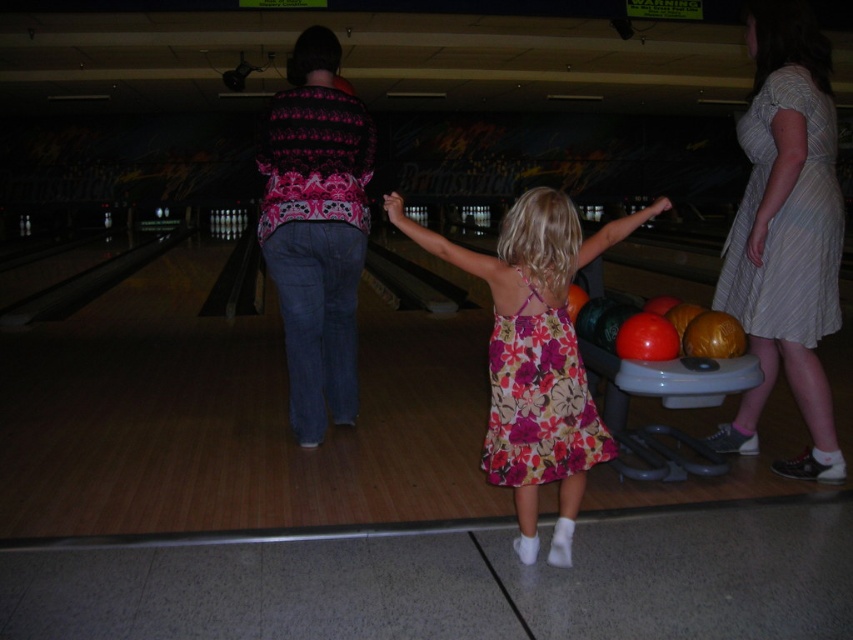
Question: Is white striped dress at right positioned at the back of floral print fabric dress at center?

Choices:
 (A) yes
 (B) no

Answer: (A)

Question: Estimate the real-world distances between objects in this image. Which object is farther from the floral print fabric dress at center?

Choices:
 (A) pink sweater at center
 (B) floral dress at center

Answer: (A)

Question: In this image, where is floral dress at center located relative to white striped dress at right?

Choices:
 (A) above
 (B) below

Answer: (B)

Question: Is floral dress at center thinner than pink sweater at center?

Choices:
 (A) no
 (B) yes

Answer: (A)

Question: Considering the real-world distances, which object is farthest from the pink sweater at center?

Choices:
 (A) floral dress at center
 (B) floral print fabric dress at center
 (C) white striped dress at right

Answer: (C)

Question: Which point is closer to the camera taking this photo?

Choices:
 (A) (764, 88)
 (B) (502, 376)

Answer: (B)